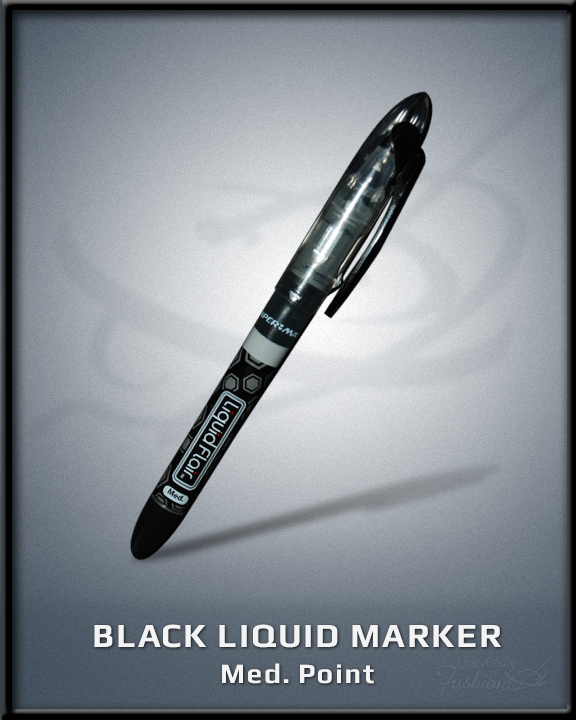
I want to click on light gray bar, so click(263, 351).